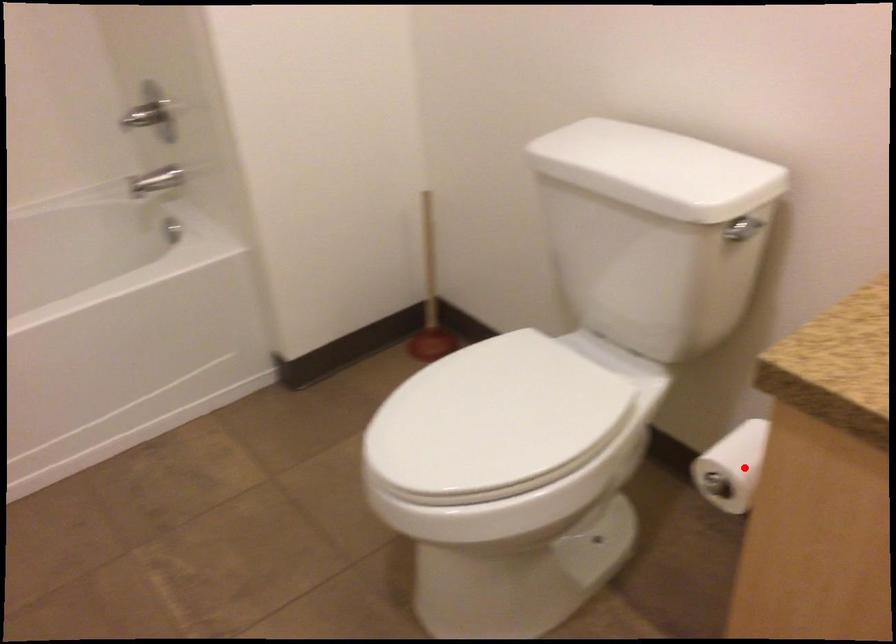
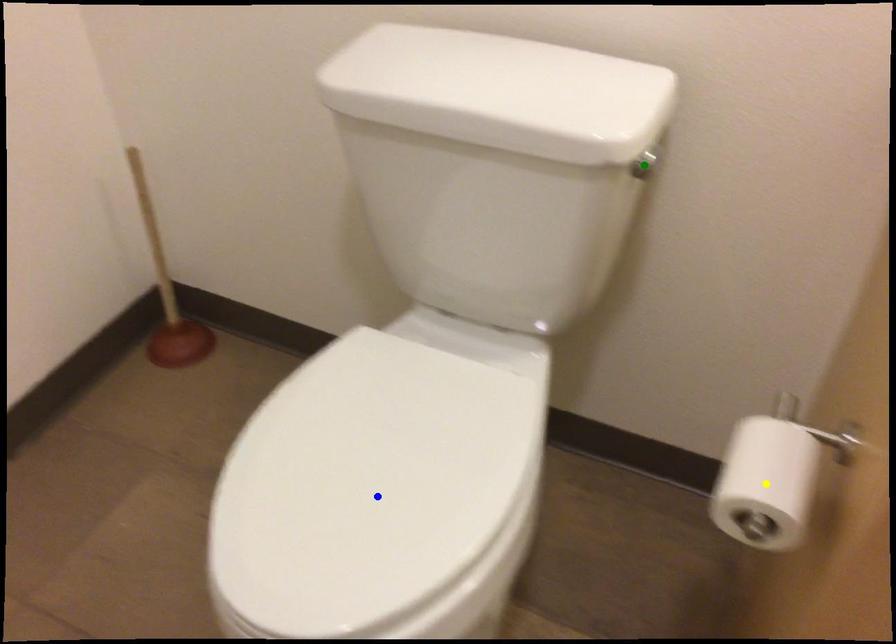
Question: I am providing you with two images of the same scene from different viewpoints. A red point is marked on the first image. You are given multiple points on the second image. Can you choose the point in image 2 that corresponds to the point in image 1?

Choices:
 (A) blue point
 (B) yellow point
 (C) green point

Answer: (B)